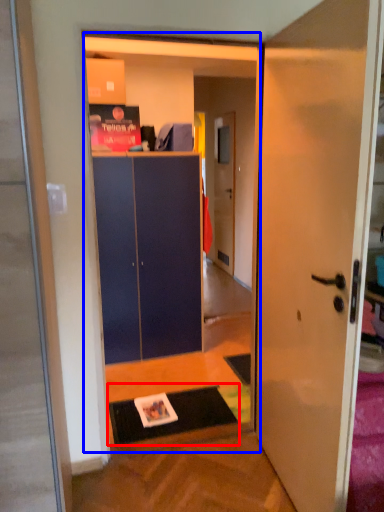
Question: Which point is closer to the camera, doormat (highlighted by a red box) or bookstore (highlighted by a blue box)?

Choices:
 (A) doormat
 (B) bookstore

Answer: (B)